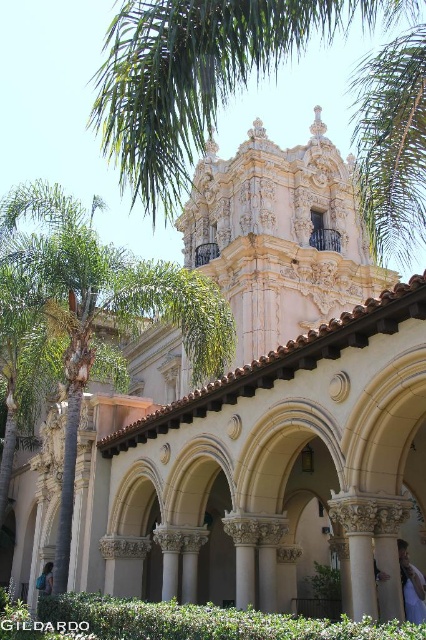
You are standing in front of the building and notice both the green leafy palm tree at center and the blue backpack at center. Which object is positioned higher relative to the other?

The green leafy palm tree at center is located above the blue backpack at center, so it is positioned higher.

You are standing in front of the building and want to place a new decorative item exactly at the position where the blue fabric at lower right is located. What are the coordinates of that location?

The coordinates of the blue fabric at lower right are at point (411, 586).

You are standing in front of a building with a covered walkway. You see a blue fabric at lower right and a blue backpack at center. Which object is taller?

The blue fabric at lower right is much taller than the blue backpack at center.